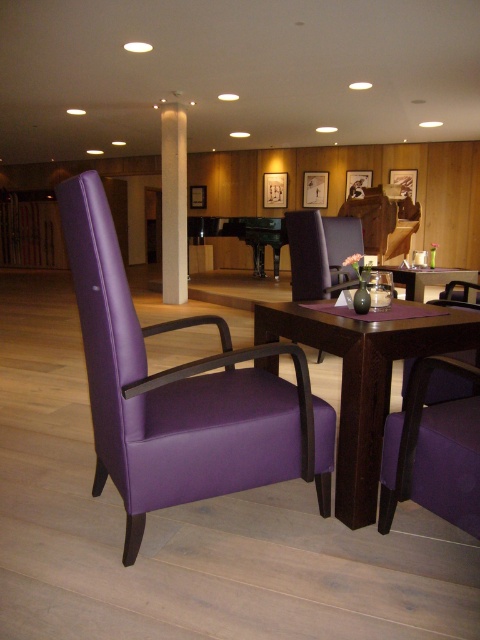
Question: Which point is closer to the camera?

Choices:
 (A) purple leather armchair at left
 (B) purple fabric chair at center
 (C) purple fabric swivel chair at lower right

Answer: (A)

Question: Which object is the farthest from the purple fabric chair at center?

Choices:
 (A) purple fabric swivel chair at lower right
 (B) purple leather armchair at left
 (C) dark wood table at center
 (D) white smooth pillar at center

Answer: (D)

Question: Can you confirm if purple fabric swivel chair at lower right is positioned below white smooth pillar at center?

Choices:
 (A) yes
 (B) no

Answer: (A)

Question: Does purple leather armchair at left have a lesser width compared to purple fabric table at center?

Choices:
 (A) yes
 (B) no

Answer: (A)

Question: Can you confirm if dark wood table at center is bigger than purple fabric chair at center?

Choices:
 (A) yes
 (B) no

Answer: (B)

Question: Which point is closer to the camera?

Choices:
 (A) (406, 445)
 (B) (361, 435)
 (C) (169, 124)

Answer: (A)